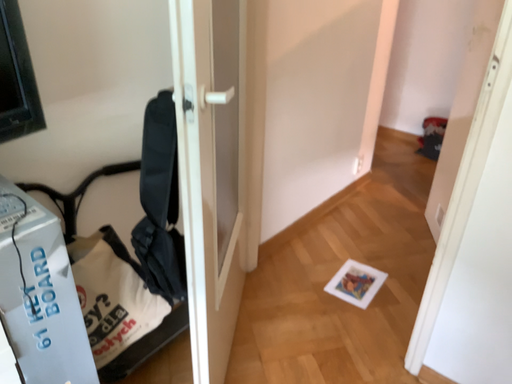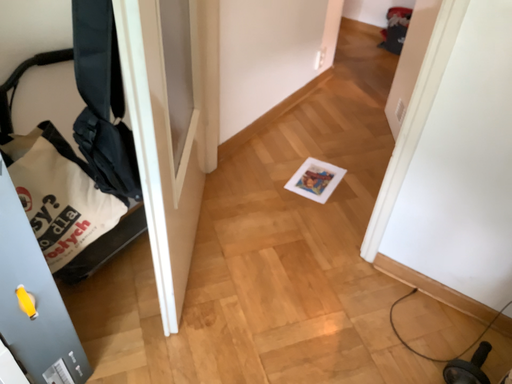
Question: How did the camera likely rotate when shooting the video?

Choices:
 (A) rotated downward
 (B) rotated upward

Answer: (A)